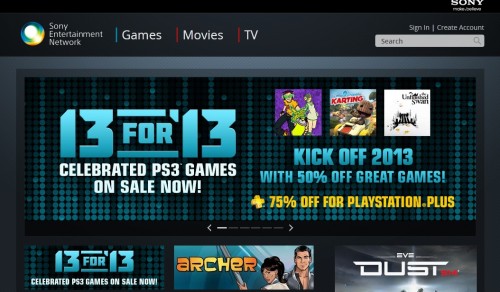
Identify the location of tv button. Image resolution: width=500 pixels, height=292 pixels. (252, 32).